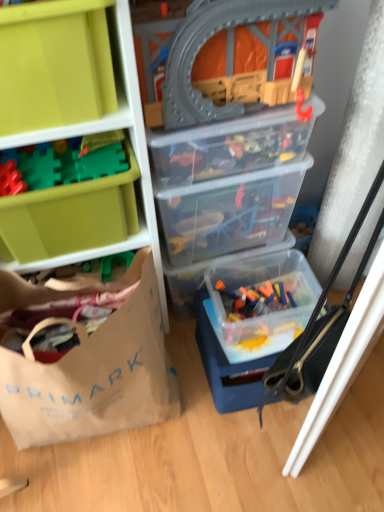
Question: From the image's perspective, would you say transparent plastic train set at upper center, positioned as the 2th toy in left-to-right order, is shown under matte green plastic storage box at upper left, placed as the first storage box when sorted from front to back?

Choices:
 (A) no
 (B) yes

Answer: (A)

Question: Is transparent plastic train set at upper center, which is the first toy in front-to-back order, smaller than matte green plastic storage box at upper left, placed as the first storage box when sorted from front to back?

Choices:
 (A) no
 (B) yes

Answer: (A)

Question: From the image's perspective, is transparent plastic train set at upper center, which is the third toy in back-to-front order, above matte green plastic storage box at upper left, placed as the first storage box when sorted from front to back?

Choices:
 (A) yes
 (B) no

Answer: (A)

Question: Considering the relative sizes of transparent plastic train set at upper center, the 3th toy from the bottom, and matte green plastic storage box at upper left, the sixth storage box positioned from the back, in the image provided, is transparent plastic train set at upper center, the 3th toy from the bottom, bigger than matte green plastic storage box at upper left, the sixth storage box positioned from the back,?

Choices:
 (A) no
 (B) yes

Answer: (B)

Question: Is transparent plastic train set at upper center, which is the first toy in front-to-back order, touching matte green plastic storage box at upper left, placed as the first storage box when sorted from front to back?

Choices:
 (A) no
 (B) yes

Answer: (A)

Question: Considering the relative sizes of transparent plastic train set at upper center, the 3th toy from the bottom, and matte green plastic storage box at upper left, placed as the first storage box when sorted from front to back, in the image provided, is transparent plastic train set at upper center, the 3th toy from the bottom, shorter than matte green plastic storage box at upper left, placed as the first storage box when sorted from front to back,?

Choices:
 (A) yes
 (B) no

Answer: (B)

Question: From a real-world perspective, does transparent plastic train set at upper center, which is the first toy in front-to-back order, sit lower than translucent plastic container at lower right, which is the 3th toy from front to back?

Choices:
 (A) yes
 (B) no

Answer: (B)

Question: Considering the relative sizes of transparent plastic train set at upper center, which is the 1th toy from top to bottom, and translucent plastic container at lower right, which is the 1th toy in right-to-left order, in the image provided, is transparent plastic train set at upper center, which is the 1th toy from top to bottom, shorter than translucent plastic container at lower right, which is the 1th toy in right-to-left order,?

Choices:
 (A) yes
 (B) no

Answer: (B)

Question: From the image's perspective, does transparent plastic train set at upper center, which is the third toy in back-to-front order, appear lower than translucent plastic container at lower right, which is the first toy from bottom to top?

Choices:
 (A) yes
 (B) no

Answer: (B)

Question: Is transparent plastic train set at upper center, the 3th toy from the bottom, facing towards translucent plastic container at lower right, which is the first toy from bottom to top?

Choices:
 (A) no
 (B) yes

Answer: (A)

Question: Does transparent plastic train set at upper center, positioned as the 2th toy in left-to-right order, have a greater height compared to translucent plastic container at lower right, which is the 1th toy in right-to-left order?

Choices:
 (A) no
 (B) yes

Answer: (B)

Question: From the image's perspective, is transparent plastic train set at upper center, which is the first toy in front-to-back order, above translucent plastic container at lower right, which is the first toy from bottom to top?

Choices:
 (A) yes
 (B) no

Answer: (A)

Question: Is transparent plastic toy train set at center, the 4th storage box when ordered from back to front, shorter than translucent plastic container at center, which is the 1th storage box in back-to-front order?

Choices:
 (A) no
 (B) yes

Answer: (B)